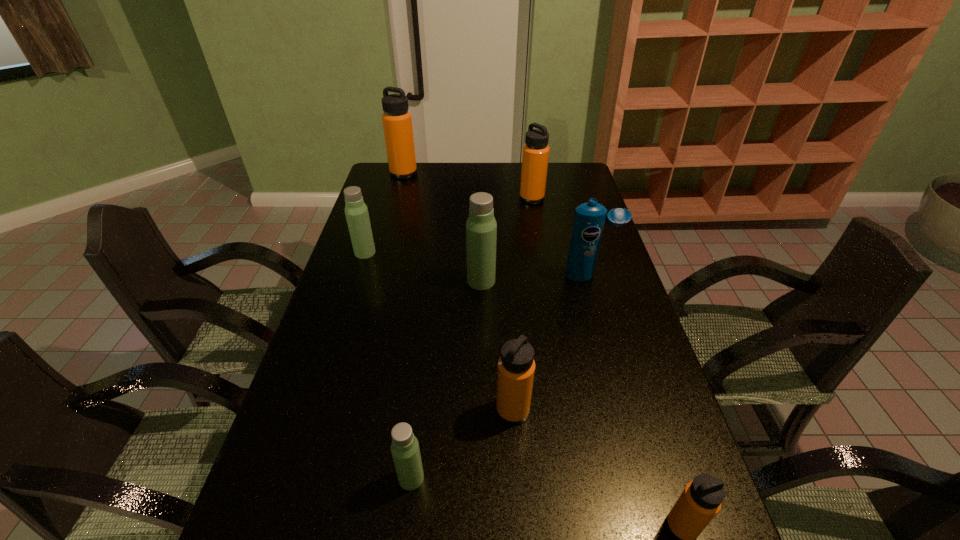
Image resolution: width=960 pixels, height=540 pixels. I want to click on the biggest orange thermos bottle, so click(x=397, y=121).

Identify the location of the farthest orange thermos bottle. This screenshot has width=960, height=540. (397, 121).

Identify the location of the fourth nearest thermos bottle. The image size is (960, 540). (481, 227).

You are a GUI agent. You are given a task and a screenshot of the screen. Output one action in this format:
    pyautogui.click(x=<x>, y=<y>)
    Task: Click on the biggest light thermos bottle
    
    Given the screenshot: What is the action you would take?
    tap(481, 227)

This screenshot has width=960, height=540. Find the location of `the second thermos bottle from right to left`. the second thermos bottle from right to left is located at coordinates (535, 155).

Where is `the second biggest orange thermos bottle`? The height and width of the screenshot is (540, 960). the second biggest orange thermos bottle is located at coordinates (535, 155).

The width and height of the screenshot is (960, 540). I want to click on shampoo, so click(589, 219).

The height and width of the screenshot is (540, 960). In order to click on the fifth nearest thermos bottle in this screenshot , I will do click(x=357, y=216).

Locate an element on the screen. This screenshot has height=540, width=960. the sixth nearest object is located at coordinates (357, 216).

Image resolution: width=960 pixels, height=540 pixels. I want to click on the fifth farthest thermos bottle, so click(516, 367).